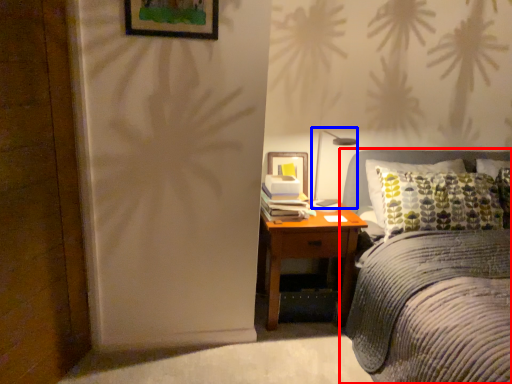
Question: Which object is closer to the camera taking this photo, bed (highlighted by a red box) or bedside lamp (highlighted by a blue box)?

Choices:
 (A) bed
 (B) bedside lamp

Answer: (A)